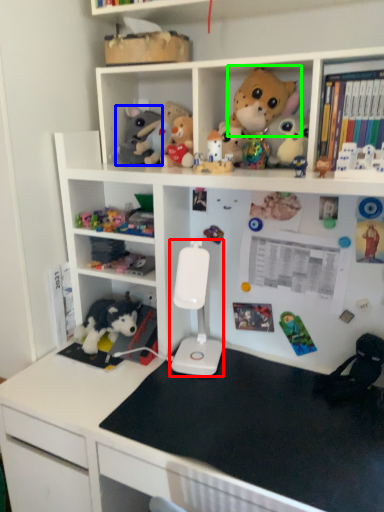
Question: Based on their relative distances, which object is nearer to equipment (highlighted by a red box)? Choose from toy (highlighted by a blue box) and toy (highlighted by a green box).

Choices:
 (A) toy
 (B) toy

Answer: (A)